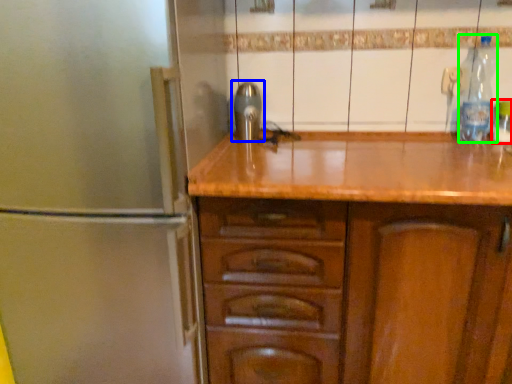
Question: Which object is positioned farthest from bottle (highlighted by a red box)? Select from tap (highlighted by a blue box) and bottle (highlighted by a green box).

Choices:
 (A) tap
 (B) bottle

Answer: (A)